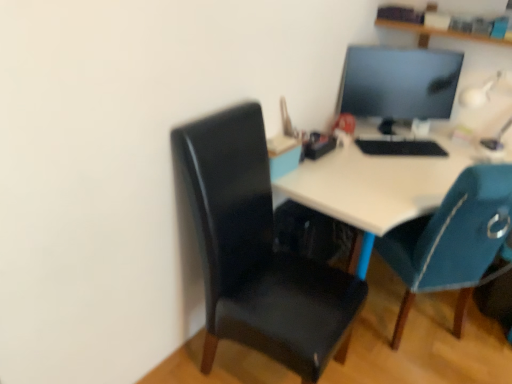
Question: Is wooden shelf at upper center looking in the opposite direction of white glossy desk at center?

Choices:
 (A) yes
 (B) no

Answer: (B)

Question: From the image's perspective, would you say wooden shelf at upper center is shown under white glossy desk at center?

Choices:
 (A) no
 (B) yes

Answer: (A)

Question: Does wooden shelf at upper center have a larger size compared to white glossy desk at center?

Choices:
 (A) yes
 (B) no

Answer: (B)

Question: Can you confirm if wooden shelf at upper center is positioned to the left of white glossy desk at center?

Choices:
 (A) yes
 (B) no

Answer: (B)

Question: Does wooden shelf at upper center lie behind white glossy desk at center?

Choices:
 (A) no
 (B) yes

Answer: (B)

Question: Can you confirm if wooden shelf at upper center is positioned to the right of white glossy desk at center?

Choices:
 (A) yes
 (B) no

Answer: (A)

Question: Does teal fabric chair at right, which is the second chair in left-to-right order, appear on the right side of white glossy table lamp at upper right?

Choices:
 (A) no
 (B) yes

Answer: (A)

Question: Is teal fabric chair at right, which is the second chair in left-to-right order, aimed at white glossy table lamp at upper right?

Choices:
 (A) yes
 (B) no

Answer: (B)

Question: Can you confirm if teal fabric chair at right, which is the second chair in left-to-right order, is thinner than white glossy table lamp at upper right?

Choices:
 (A) no
 (B) yes

Answer: (A)

Question: Is teal fabric chair at right, which is counted as the first chair, starting from the right, placed right next to white glossy table lamp at upper right?

Choices:
 (A) yes
 (B) no

Answer: (B)

Question: Does teal fabric chair at right, which is the second chair in left-to-right order, come behind white glossy table lamp at upper right?

Choices:
 (A) no
 (B) yes

Answer: (A)

Question: Is teal fabric chair at right, which is the second chair in left-to-right order, positioned before white glossy table lamp at upper right?

Choices:
 (A) no
 (B) yes

Answer: (B)

Question: From the image's perspective, is teal fabric chair at right, which is counted as the first chair, starting from the right, above wooden shelf at upper center?

Choices:
 (A) no
 (B) yes

Answer: (A)